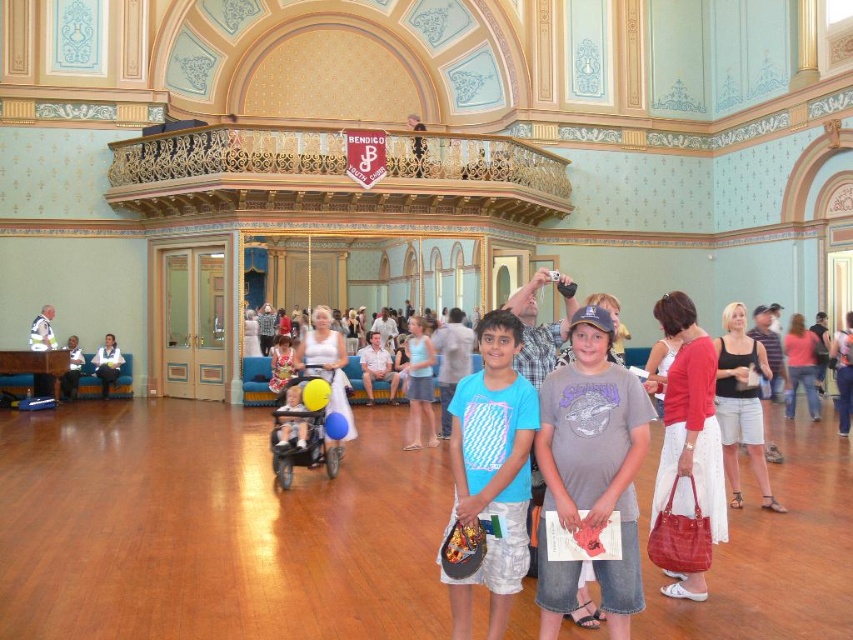
Does blue cotton shirt at center have a lesser height compared to white shirt at lower left?

No, blue cotton shirt at center is not shorter than white shirt at lower left.

The height and width of the screenshot is (640, 853). What do you see at coordinates (492, 470) in the screenshot?
I see `blue cotton shirt at center` at bounding box center [492, 470].

The height and width of the screenshot is (640, 853). In order to click on blue cotton shirt at center in this screenshot , I will do `click(492, 470)`.

Is matte plastic baby carriage at center below white shirt at lower left?

Yes, matte plastic baby carriage at center is below white shirt at lower left.

From the picture: Can you confirm if matte plastic baby carriage at center is bigger than white shirt at lower left?

Yes.

Is point (293, 426) more distant than point (70, 385)?

No, (293, 426) is closer to viewer.

Locate an element on the screen. matte plastic baby carriage at center is located at coordinates (292, 429).

Can you confirm if blue cotton shirt at center is positioned above matte plastic baby carriage at center?

Yes, blue cotton shirt at center is above matte plastic baby carriage at center.

What do you see at coordinates (492, 470) in the screenshot?
I see `blue cotton shirt at center` at bounding box center [492, 470].

Is point (454, 456) closer to camera compared to point (283, 426)?

Yes, it is.

You are a GUI agent. You are given a task and a screenshot of the screen. Output one action in this format:
    pyautogui.click(x=<x>, y=<y>)
    Task: Click on the blue cotton shirt at center
    This screenshot has height=640, width=853.
    Given the screenshot: What is the action you would take?
    pyautogui.click(x=492, y=470)